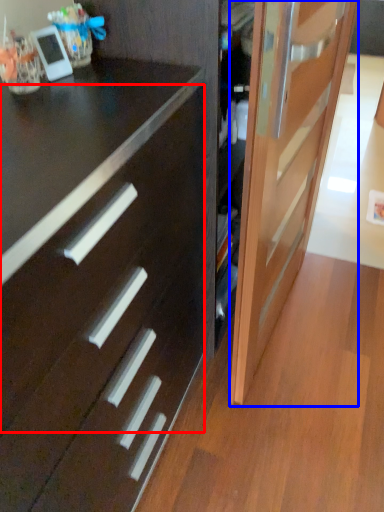
Question: Among these objects, which one is nearest to the camera, drawer (highlighted by a red box) or door (highlighted by a blue box)?

Choices:
 (A) drawer
 (B) door

Answer: (A)